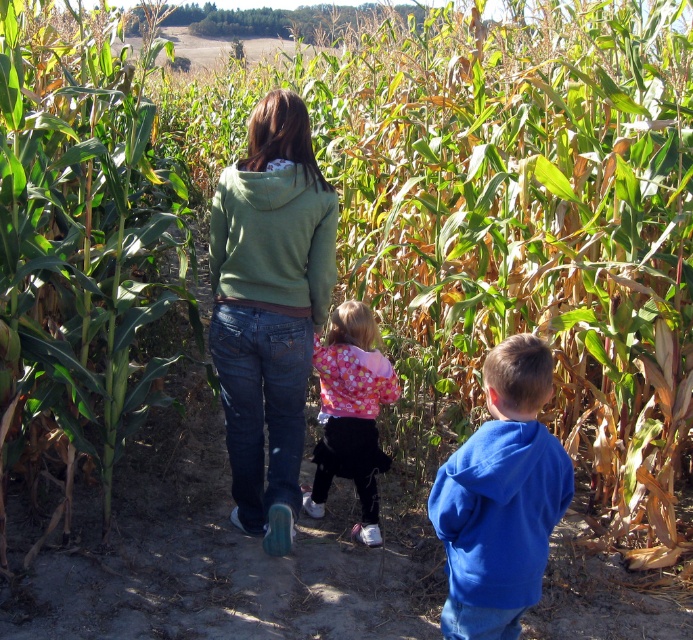
Between green matte hoodie at center and blue fleece jacket at center, which one appears on the left side from the viewer's perspective?

Positioned to the left is green matte hoodie at center.

Does point (307, 266) lie in front of point (507, 371)?

No, it is behind (507, 371).

Find the location of a particular element. green matte hoodie at center is located at coordinates (270, 307).

Is blue fleece jacket at center to the left of green matte sweatshirt at center from the viewer's perspective?

Incorrect, blue fleece jacket at center is not on the left side of green matte sweatshirt at center.

Which of these two, blue fleece jacket at center or green matte sweatshirt at center, stands taller?

Standing taller between the two is blue fleece jacket at center.

Where is `blue fleece jacket at center`? This screenshot has width=693, height=640. blue fleece jacket at center is located at coordinates 500,499.

From the picture: Who is shorter, green matte sweatshirt at center or fluffy pink sweater at center?

green matte sweatshirt at center is shorter.

Is point (261, 227) closer to camera compared to point (367, 508)?

Yes, it is.

Between point (313, 268) and point (333, 358), which one is positioned in front?

Point (313, 268)

This screenshot has width=693, height=640. I want to click on green matte sweatshirt at center, so click(x=272, y=241).